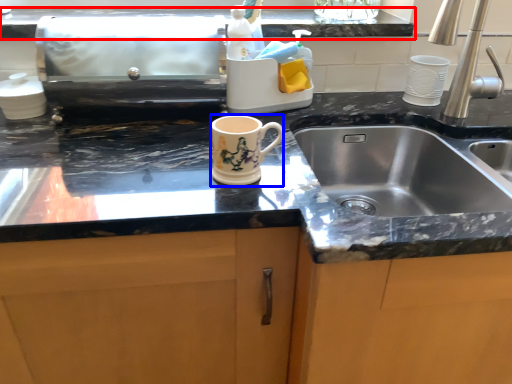
Question: Which object appears closest to the camera in this image, countertop (highlighted by a red box) or mug (highlighted by a blue box)?

Choices:
 (A) countertop
 (B) mug

Answer: (B)